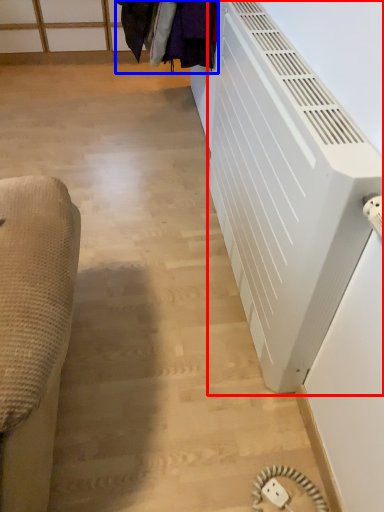
Question: Which of the following is the farthest to the observer, air conditioning (highlighted by a red box) or laundry (highlighted by a blue box)?

Choices:
 (A) air conditioning
 (B) laundry

Answer: (B)